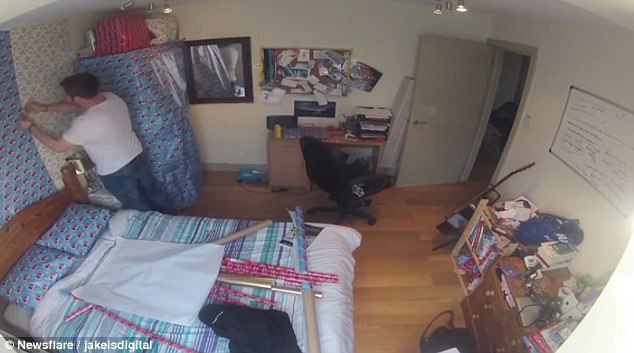
You are a GUI agent. You are given a task and a screenshot of the screen. Output one action in this format:
    pyautogui.click(x=<x>, y=<y>)
    Task: Click on the whiteboard
    This screenshot has width=634, height=353.
    Given the screenshot: What is the action you would take?
    pyautogui.click(x=589, y=134)